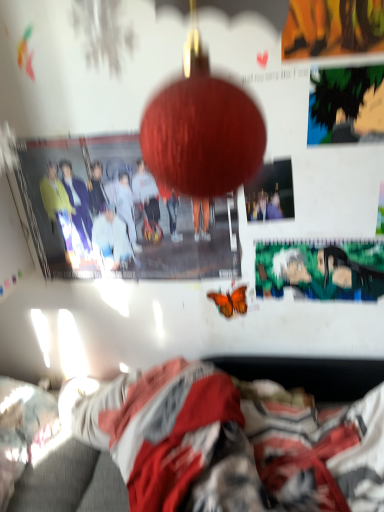
Question: From the image's perspective, does fluffy white pillow at lower left appear higher than fluffy blanket at lower center?

Choices:
 (A) no
 (B) yes

Answer: (B)

Question: Considering the relative sizes of fluffy white pillow at lower left and fluffy blanket at lower center in the image provided, is fluffy white pillow at lower left taller than fluffy blanket at lower center?

Choices:
 (A) yes
 (B) no

Answer: (B)

Question: Can fluffy blanket at lower center be found inside fluffy white pillow at lower left?

Choices:
 (A) no
 (B) yes

Answer: (A)

Question: Is fluffy blanket at lower center at the back of fluffy white pillow at lower left?

Choices:
 (A) no
 (B) yes

Answer: (B)

Question: Considering the relative sizes of fluffy white pillow at lower left and fluffy blanket at lower center in the image provided, is fluffy white pillow at lower left smaller than fluffy blanket at lower center?

Choices:
 (A) yes
 (B) no

Answer: (A)

Question: Is point (233, 292) positioned closer to the camera than point (261, 172)?

Choices:
 (A) farther
 (B) closer

Answer: (A)

Question: From the image's perspective, relative to matte paper poster at center, the second poster page viewed from the top, is orange matte butterfly at center above or below?

Choices:
 (A) below
 (B) above

Answer: (A)

Question: Looking at their shapes, would you say orange matte butterfly at center is wider or thinner than matte paper poster at center, which is counted as the second poster page, starting from the bottom?

Choices:
 (A) thin
 (B) wide

Answer: (A)

Question: Visually, is orange matte butterfly at center positioned to the left or to the right of matte paper poster at center, which ranks as the second poster page in front-to-back order?

Choices:
 (A) right
 (B) left

Answer: (B)

Question: Is fluffy blanket at lower center spatially inside fluffy white pillow at lower left, or outside of it?

Choices:
 (A) outside
 (B) inside

Answer: (A)

Question: Is point (158, 409) positioned closer to the camera than point (26, 450)?

Choices:
 (A) farther
 (B) closer

Answer: (B)

Question: From the image's perspective, is fluffy blanket at lower center above or below fluffy white pillow at lower left?

Choices:
 (A) below
 (B) above

Answer: (A)

Question: Is fluffy blanket at lower center bigger or smaller than fluffy white pillow at lower left?

Choices:
 (A) small
 (B) big

Answer: (B)

Question: Considering the positions of fluffy white pillow at lower left and fluffy blanket at lower center in the image, is fluffy white pillow at lower left wider or thinner than fluffy blanket at lower center?

Choices:
 (A) thin
 (B) wide

Answer: (A)

Question: In the image, is fluffy white pillow at lower left positioned in front of or behind fluffy blanket at lower center?

Choices:
 (A) behind
 (B) front

Answer: (A)